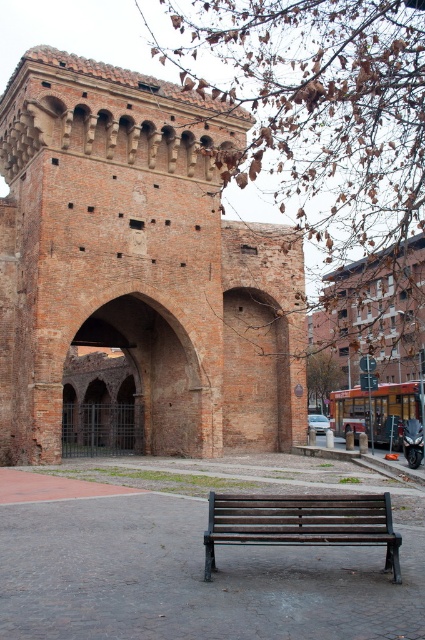
Question: Does brick/tiled fort at center appear over brick archway at center?

Choices:
 (A) yes
 (B) no

Answer: (A)

Question: Which object appears farthest from the camera in this image?

Choices:
 (A) wooden bench at center
 (B) brick/tiled fort at center

Answer: (B)

Question: Which object is farther from the camera taking this photo?

Choices:
 (A) brick archway at center
 (B) brick/tiled fort at center
 (C) wooden bench at center

Answer: (A)

Question: Does brick/tiled fort at center have a lesser width compared to wooden bench at center?

Choices:
 (A) yes
 (B) no

Answer: (B)

Question: Among these objects, which one is farthest from the camera?

Choices:
 (A) brick archway at center
 (B) wooden bench at center

Answer: (A)

Question: Does brick/tiled fort at center appear on the right side of wooden bench at center?

Choices:
 (A) no
 (B) yes

Answer: (A)